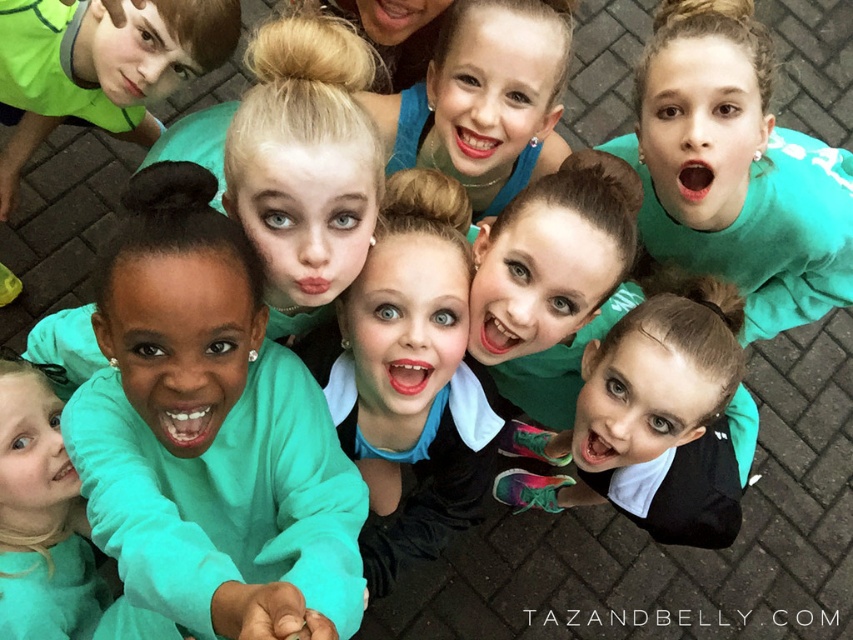
Question: Is the position of teal fleece sweatshirt at center more distant than that of teal fleece sweatshirt at upper left?

Choices:
 (A) yes
 (B) no

Answer: (B)

Question: Is teal fleece sweatshirt at center to the right of teal fleece sweatshirt at upper left from the viewer's perspective?

Choices:
 (A) no
 (B) yes

Answer: (B)

Question: Does teal fleece sweatshirt at center have a larger size compared to teal fleece sweatshirt at upper left?

Choices:
 (A) no
 (B) yes

Answer: (A)

Question: Which of the following is the farthest from the observer?

Choices:
 (A) teal fleece sweatshirt at upper left
 (B) teal fleece sweatshirt at center

Answer: (A)

Question: Among these points, which one is nearest to the camera?

Choices:
 (A) (196, 531)
 (B) (102, 116)

Answer: (A)